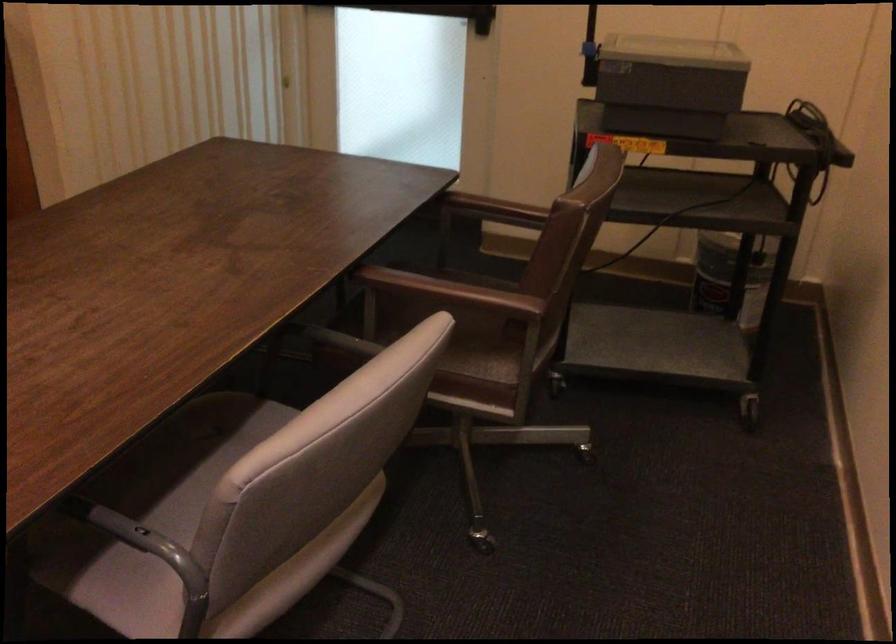
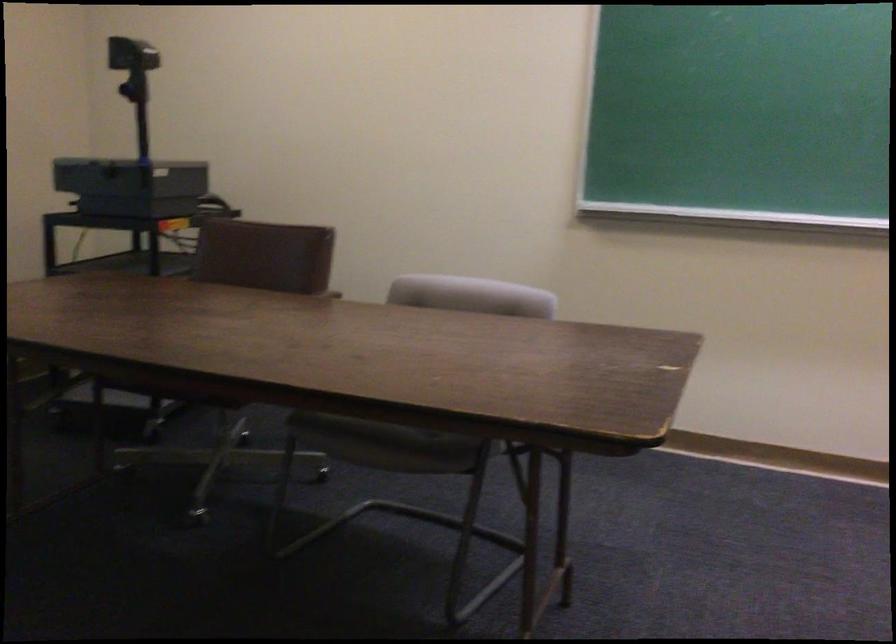
Locate, in the second image, the point that corresponds to point 607,69 in the first image.

(131, 180)